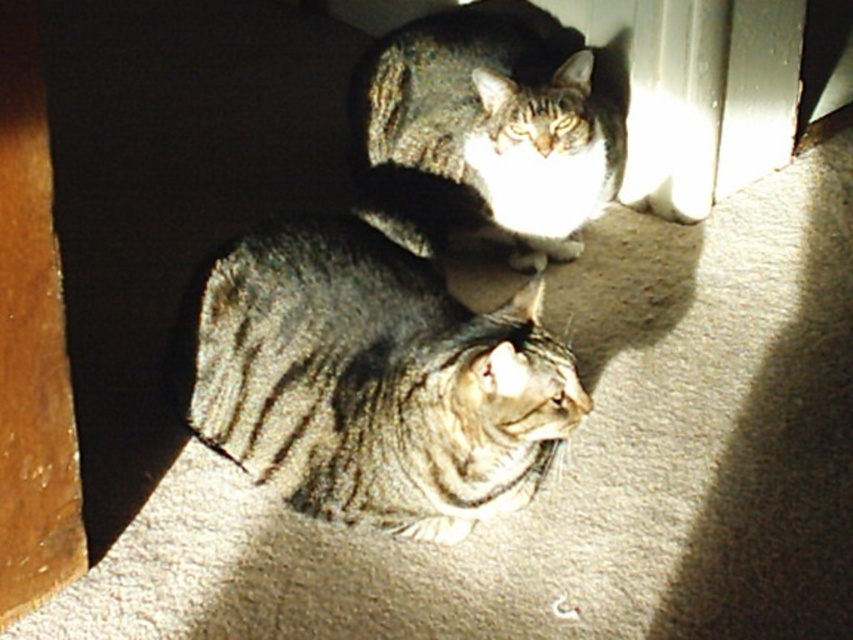
Is tabby fur cat at lower center further to the viewer compared to tabby fur cat at center?

No, it is in front of tabby fur cat at center.

Does point (340, 477) come farther from viewer compared to point (575, 177)?

That is False.

At what (x,y) coordinates should I click in order to perform the action: click on tabby fur cat at lower center. Please return your answer as a coordinate pair (x, y). Looking at the image, I should click on (375, 380).

This screenshot has width=853, height=640. I want to click on tabby fur cat at lower center, so click(x=375, y=380).